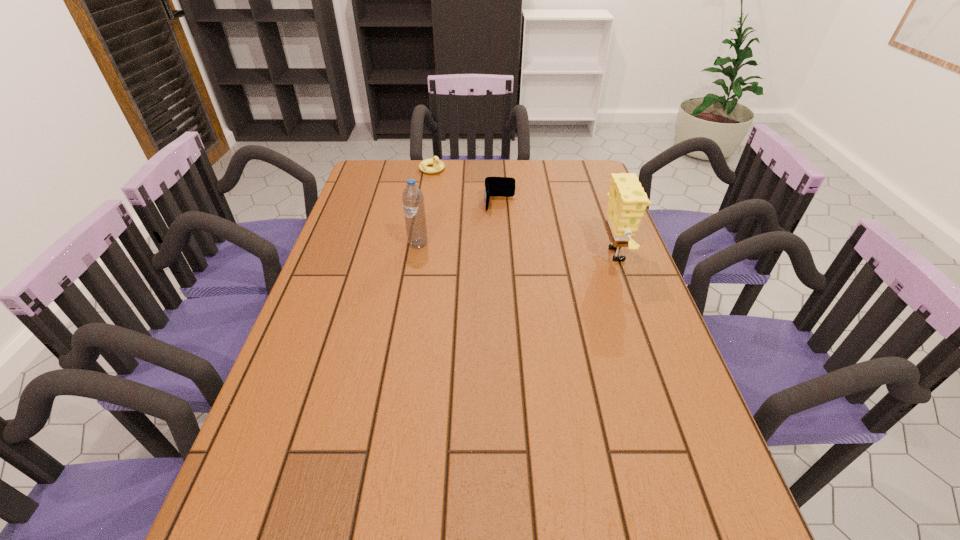
Where is `water bottle`? water bottle is located at coordinates (413, 200).

Image resolution: width=960 pixels, height=540 pixels. In order to click on the rightmost object in this screenshot , I will do `click(627, 201)`.

This screenshot has height=540, width=960. I want to click on the second object from right to left, so click(x=494, y=186).

Where is `the third nearest object`? the third nearest object is located at coordinates (494, 186).

Image resolution: width=960 pixels, height=540 pixels. Identify the location of the farthest object. (438, 165).

Identify the location of free space located on the right of the water bottle. The height and width of the screenshot is (540, 960). (498, 244).

Where is `vacant space located on the outer surface of the third nearest object`? The height and width of the screenshot is (540, 960). vacant space located on the outer surface of the third nearest object is located at coordinates (505, 295).

Image resolution: width=960 pixels, height=540 pixels. In order to click on free space located on the outer surface of the third nearest object in this screenshot , I will do `click(504, 287)`.

Where is `vacant area situated on the outer surface of the third nearest object`? vacant area situated on the outer surface of the third nearest object is located at coordinates (503, 264).

Locate an element on the screen. This screenshot has height=540, width=960. vacant position located 0.320m on the face of the farthest object is located at coordinates (484, 213).